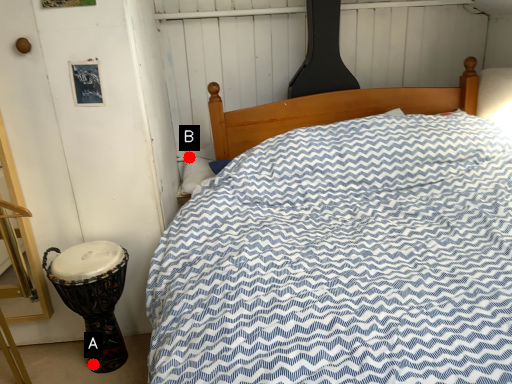
Question: Two points are circled on the image, labeled by A and B beside each circle. Among these points, which one is nearest to the camera?

Choices:
 (A) A is closer
 (B) B is closer

Answer: (A)